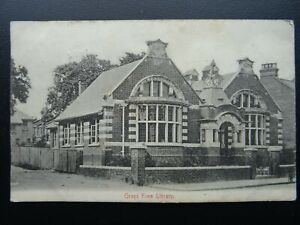
In order to click on window in this screenshot , I will do `click(151, 122)`.